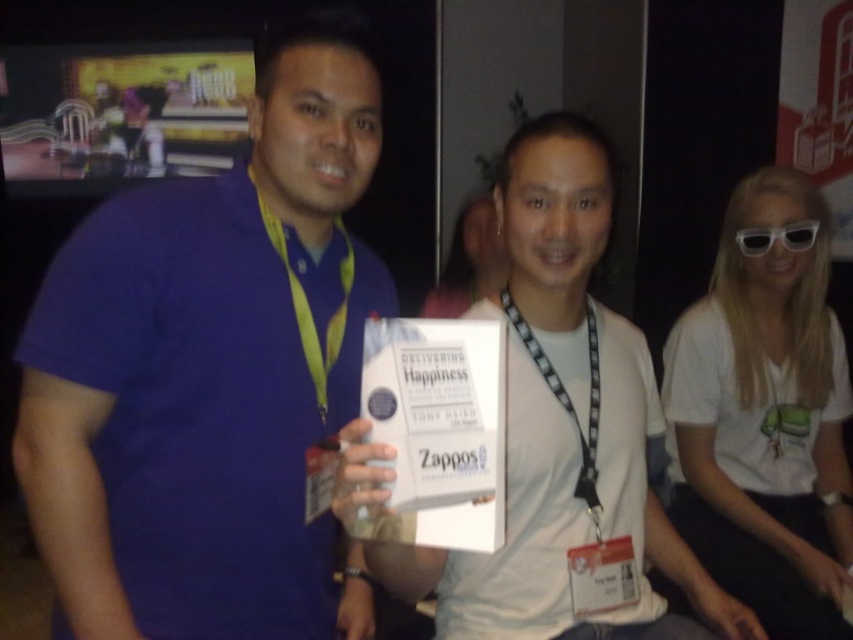
Can you confirm if white matte book at center is taller than white matte t-shirt at center?

No, white matte book at center is not taller than white matte t-shirt at center.

Who is lower down, white matte book at center or white matte t-shirt at center?

white matte book at center

Between point (611, 440) and point (828, 426), which one is positioned in front?

Point (611, 440)

Where is `white matte book at center`? This screenshot has width=853, height=640. white matte book at center is located at coordinates (566, 426).

Which of these two, matte blue shirt at left or white matte book at center, stands shorter?

With less height is white matte book at center.

Who is lower down, matte blue shirt at left or white matte book at center?

white matte book at center is below.

Is point (172, 376) behind point (549, 161)?

No.

Locate an element on the screen. matte blue shirt at left is located at coordinates (207, 371).

Which is more to the left, white matte t-shirt at center or white plastic goggles at upper right?

Positioned to the left is white plastic goggles at upper right.

Who is lower down, white matte t-shirt at center or white plastic goggles at upper right?

white matte t-shirt at center

Locate an element on the screen. The height and width of the screenshot is (640, 853). white matte t-shirt at center is located at coordinates (764, 419).